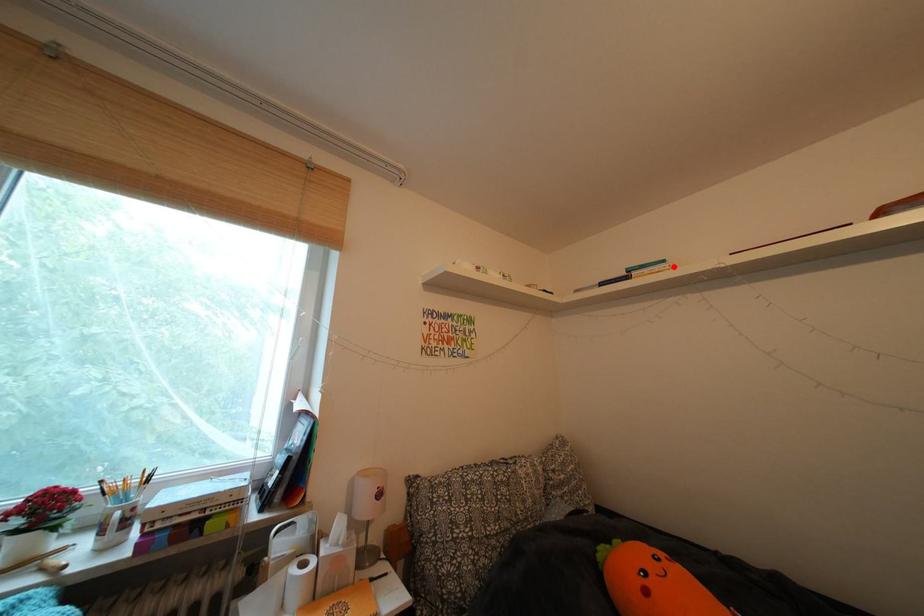
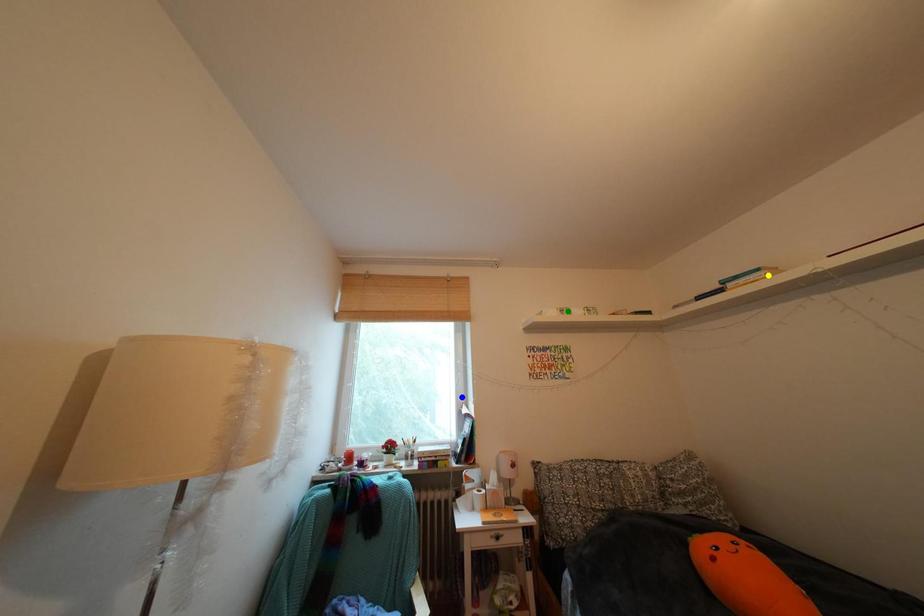
Question: I am providing you with two images of the same scene from different viewpoints. A red point is marked on the first image. You are given multiple points on the second image. Which point in image 2 represents the same 3d spot as the red point in image 1?

Choices:
 (A) yellow point
 (B) green point
 (C) blue point

Answer: (A)